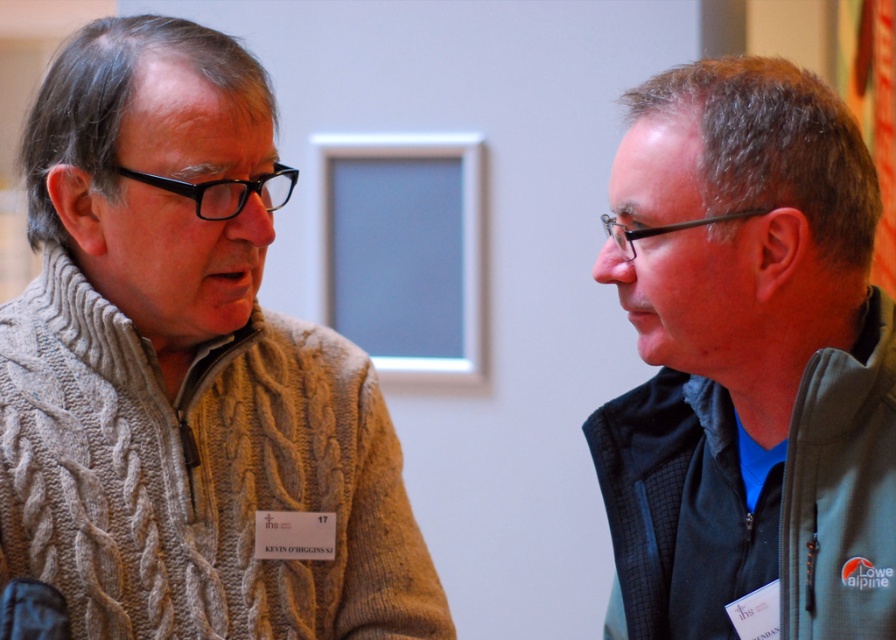
Question: Which point appears farthest from the camera in this image?

Choices:
 (A) (123, 429)
 (B) (622, 298)

Answer: (A)

Question: Observing the image, what is the correct spatial positioning of knitted beige sweater at left in reference to green fleece jacket at right?

Choices:
 (A) below
 (B) above

Answer: (A)

Question: Can you confirm if knitted beige sweater at left is positioned above green fleece jacket at right?

Choices:
 (A) no
 (B) yes

Answer: (A)

Question: Where is knitted beige sweater at left located in relation to green fleece jacket at right in the image?

Choices:
 (A) above
 (B) below

Answer: (B)